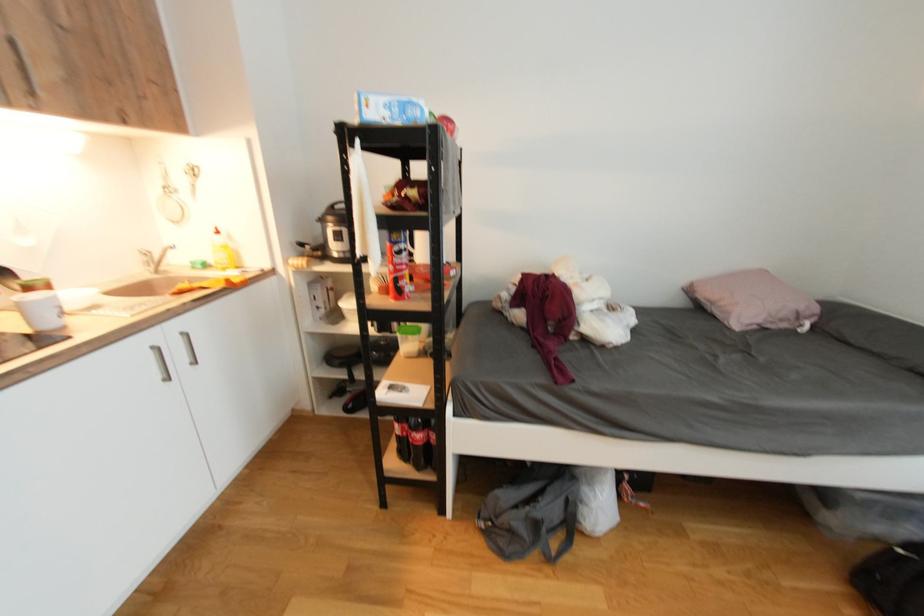
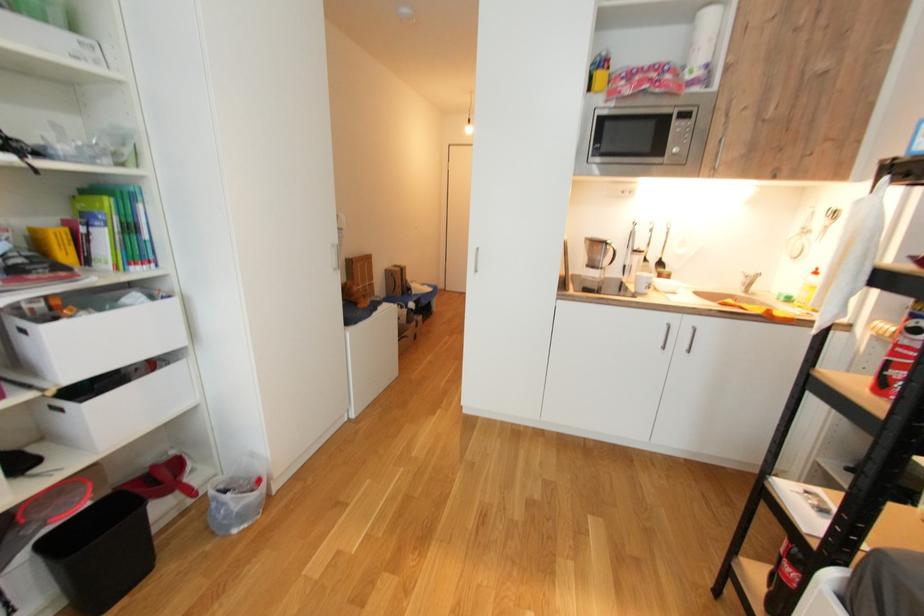
The first image is from the beginning of the video and the second image is from the end. How did the camera likely rotate when shooting the video?

The camera rotated toward left-down.